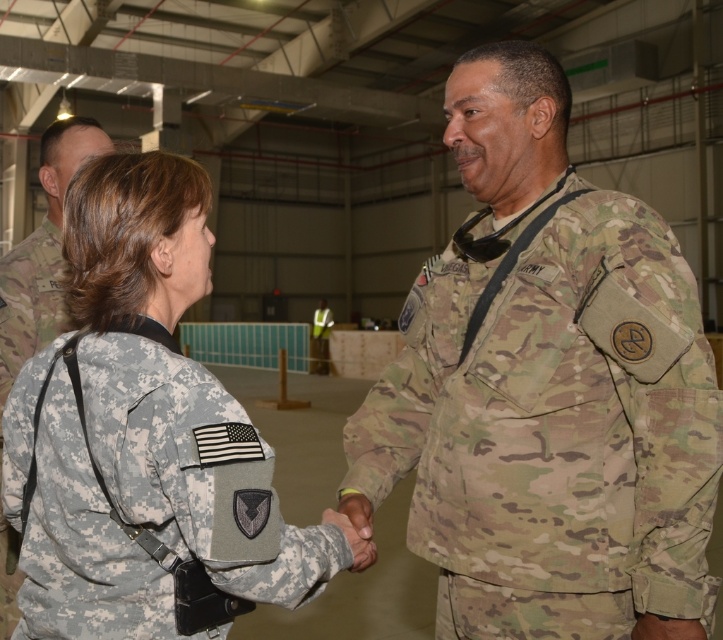
You are a photographer positioned at the back of the hangar. You need to capture a photo where both the camo uniform at center and the camouflage fabric uniform at center are clearly visible. Given their heights, which uniform should be placed closer to the front to ensure both are visible in the frame?

The camo uniform at center is taller than the camouflage fabric uniform at center, so to ensure both are visible in the frame, the shorter camouflage fabric uniform at center should be placed closer to the front.

You are a photographer standing in the hangar and want to take a closeup photo of the camouflage fabric uniform at center. If your camera has a minimum focusing distance of 3.5 feet, will you be able to take the photo without moving closer?

The camouflage fabric uniform at center is 4.04 feet away from the viewer. Since the minimum focusing distance is 3.5 feet, the photographer needs to move 0.54 feet closer to be within range.

You are a photographer positioned in front of the two military personnel. You want to take a photo focusing on the camouflage fabric uniform at center and the camouflage uniform at center. Which one will appear larger in the photo?

The camouflage fabric uniform at center will appear larger in the photo because it is closer to the viewer than the camouflage uniform at center.